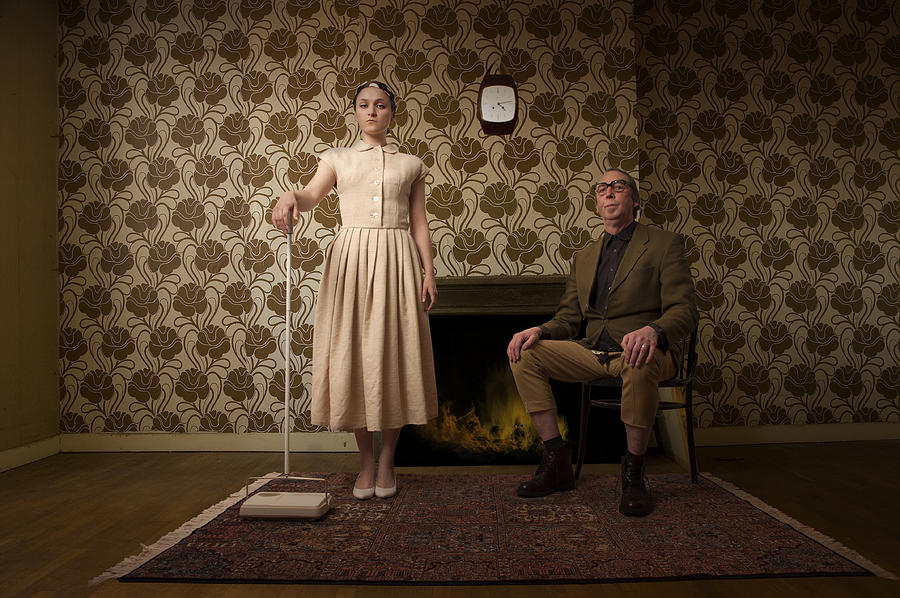
Find the location of `brown wooden floor with rectangular designs`. brown wooden floor with rectangular designs is located at coordinates point(127,504).